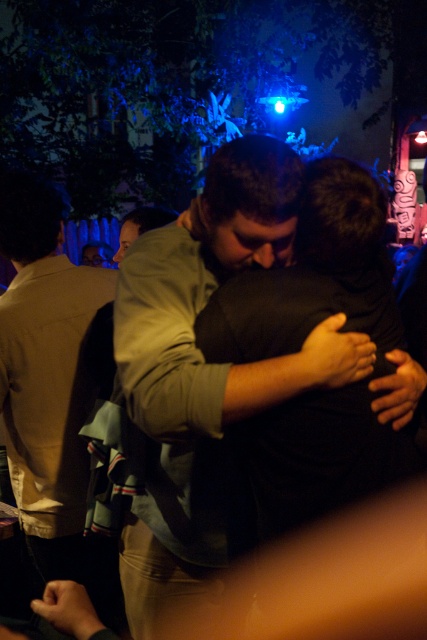
You are a photographer at the event and want to capture a wide shot of the scene. The light brown leather jacket at left and the matte green shirt at center are in your frame. Which object appears narrower in the photo?

The light brown leather jacket at left appears narrower than the matte green shirt at center in the photo.